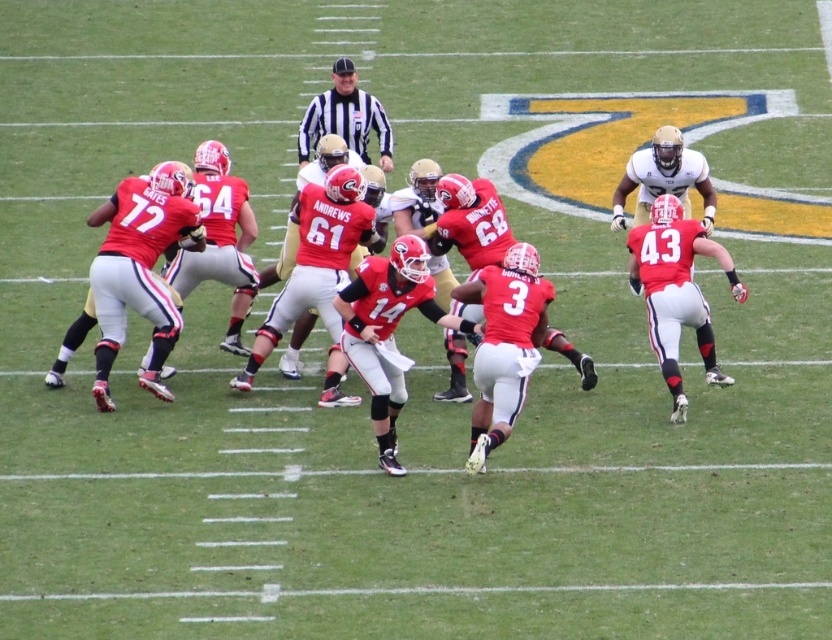
Does matte red jersey at center have a smaller size compared to striped jersey referee at center?

No.

Between point (582, 122) and point (306, 129), which one is positioned behind?

Positioned behind is point (582, 122).

Identify the location of matte red jersey at center. (416, 204).

You are a GUI agent. You are given a task and a screenshot of the screen. Output one action in this format:
    pyautogui.click(x=<x>, y=<y>)
    Task: Click on the matte red jersey at center
    Image resolution: width=832 pixels, height=640 pixels.
    Given the screenshot: What is the action you would take?
    pyautogui.click(x=416, y=204)

Is matte red jersey at center above matte red jersey at right?

Yes.

Is matte red jersey at center taller than matte red jersey at right?

Indeed, matte red jersey at center has a greater height compared to matte red jersey at right.

Is point (355, 257) positioned after point (677, 333)?

Yes, point (355, 257) is behind point (677, 333).

You are a GUI agent. You are given a task and a screenshot of the screen. Output one action in this format:
    pyautogui.click(x=<x>, y=<y>)
    Task: Click on the matte red jersey at center
    
    Given the screenshot: What is the action you would take?
    pyautogui.click(x=416, y=204)

In the scene shown: Measure the distance between matte red jersey at right and camera.

They are 10.99 meters apart.

You are a GUI agent. You are given a task and a screenshot of the screen. Output one action in this format:
    pyautogui.click(x=<x>, y=<y>)
    Task: Click on the matte red jersey at right
    This screenshot has width=832, height=640.
    Given the screenshot: What is the action you would take?
    pyautogui.click(x=676, y=291)